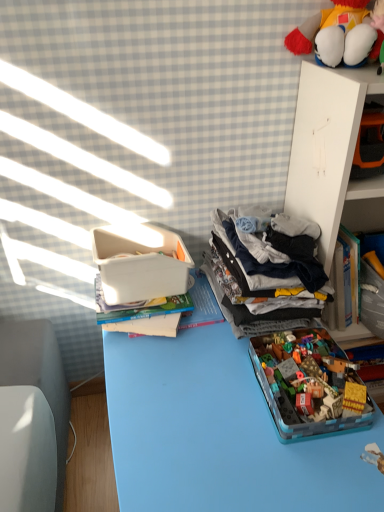
At what (x,y) coordinates should I click in order to perform the action: click on vacant area in front of white plastic container at upper left. Please return your answer as a coordinate pair (x, y). The width and height of the screenshot is (384, 512). Looking at the image, I should click on (165, 364).